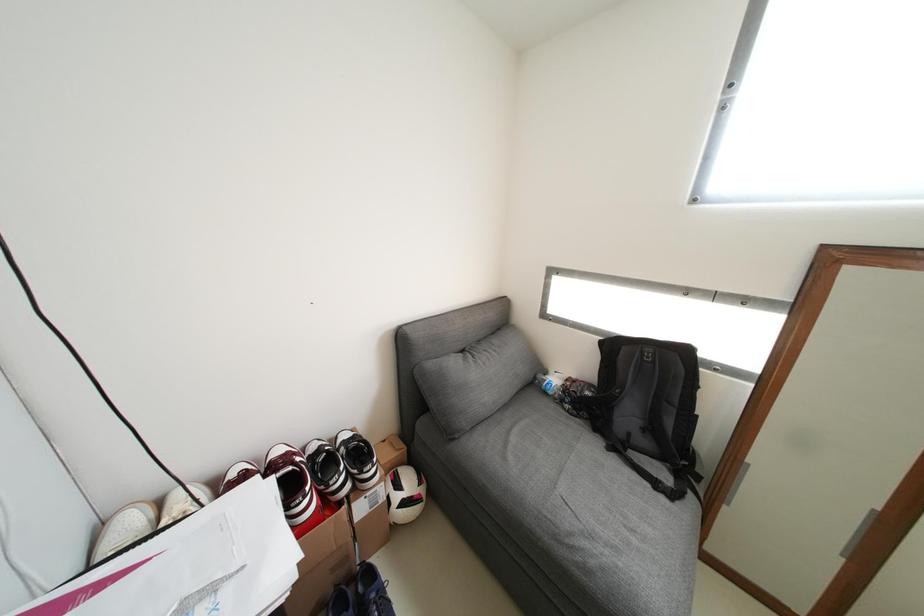
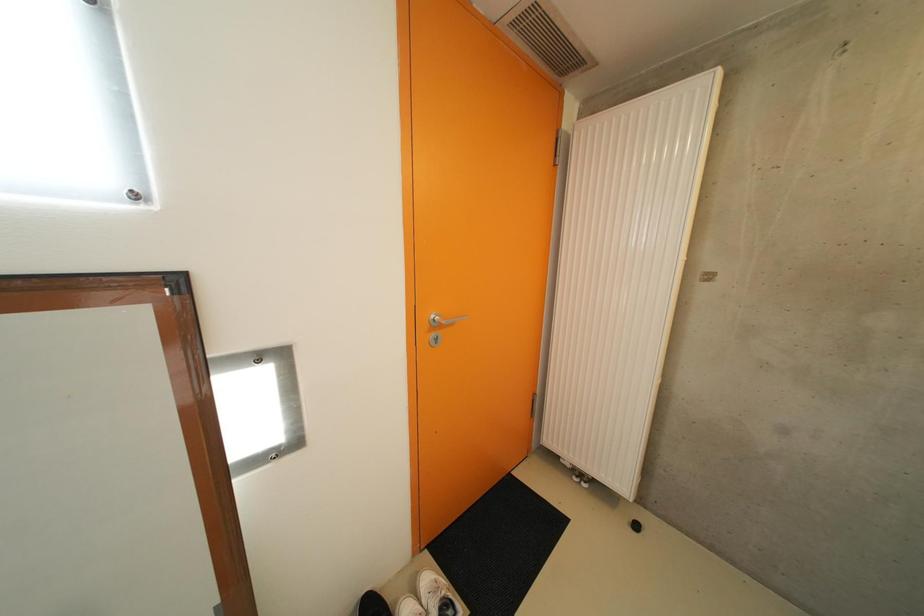
Question: How did the camera likely rotate?

Choices:
 (A) Left
 (B) Right
 (C) Up
 (D) Down

Answer: (B)